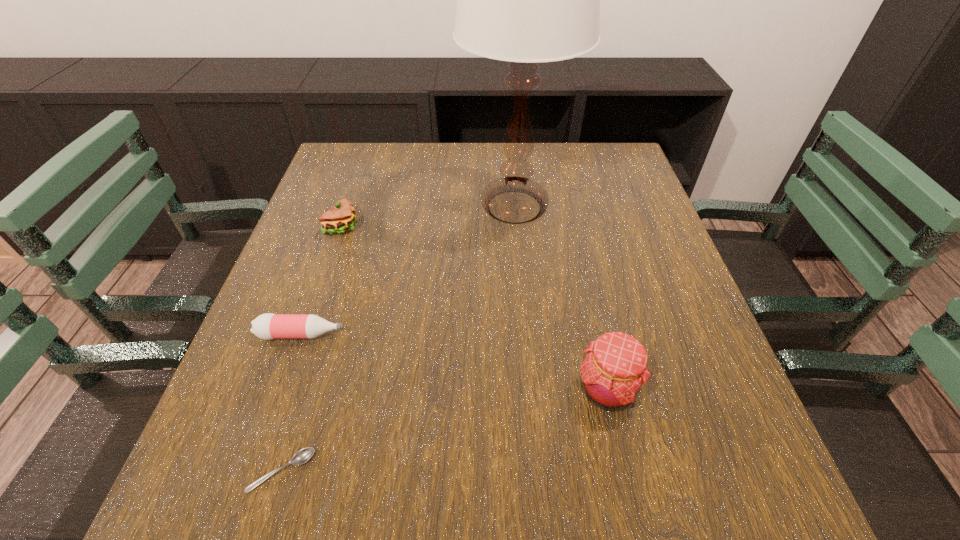
You are a GUI agent. You are given a task and a screenshot of the screen. Output one action in this format:
    pyautogui.click(x=<x>, y=<y>)
    Task: Click on the blank space at the far edge of the desktop
    The image size is (960, 540).
    Given the screenshot: What is the action you would take?
    pyautogui.click(x=475, y=178)

Identify the location of vacant space at the right edge of the desktop. The width and height of the screenshot is (960, 540). (604, 281).

You are a GUI agent. You are given a task and a screenshot of the screen. Output one action in this format:
    pyautogui.click(x=<x>, y=<y>)
    Task: Click on the free space at the far left corner
    This screenshot has width=960, height=540.
    Given the screenshot: What is the action you would take?
    pyautogui.click(x=328, y=167)

In the image, there is a desktop. Where is `vacant space at the far right corner`? This screenshot has width=960, height=540. vacant space at the far right corner is located at coordinates (603, 146).

Find the location of a particular element. Image resolution: width=960 pixels, height=540 pixels. free space between the shortest object and the table lamp is located at coordinates (397, 339).

Locate an element on the screen. vacant space that is in between the third farthest object and the second tallest object is located at coordinates (454, 362).

Image resolution: width=960 pixels, height=540 pixels. I want to click on free spot between the second tallest object and the table lamp, so (561, 298).

I want to click on free space between the bottle and the soupspoon, so click(292, 403).

The image size is (960, 540). Identify the location of vacant area that lies between the bottle and the sandwich. (323, 281).

Locate an element on the screen. vacant point located between the third nearest object and the second nearest object is located at coordinates (454, 362).